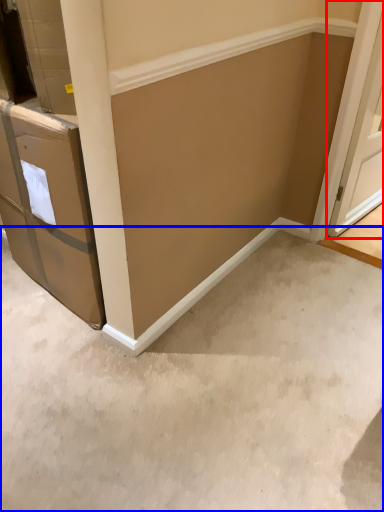
Question: Which point is further to the camera, door (highlighted by a red box) or concrete (highlighted by a blue box)?

Choices:
 (A) door
 (B) concrete

Answer: (A)